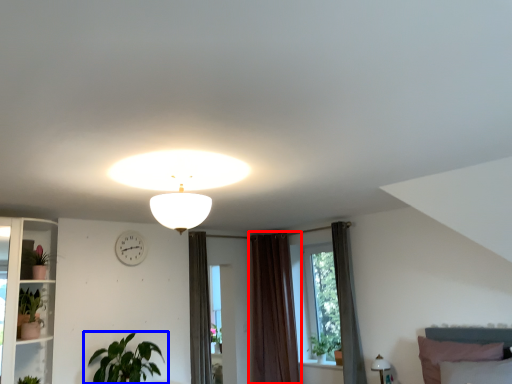
Question: Which point is closer to the camera, curtain (highlighted by a red box) or houseplant (highlighted by a blue box)?

Choices:
 (A) curtain
 (B) houseplant

Answer: (B)